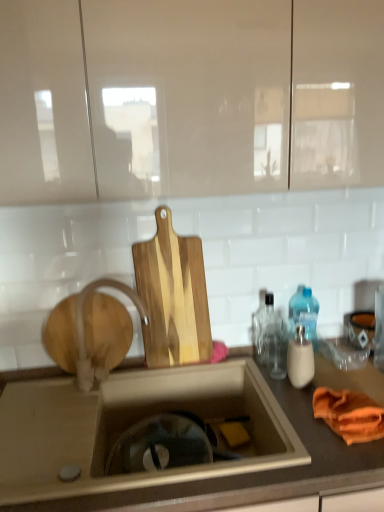
Identify the location of vacant region to the left of wooden at left. The height and width of the screenshot is (512, 384). (32, 385).